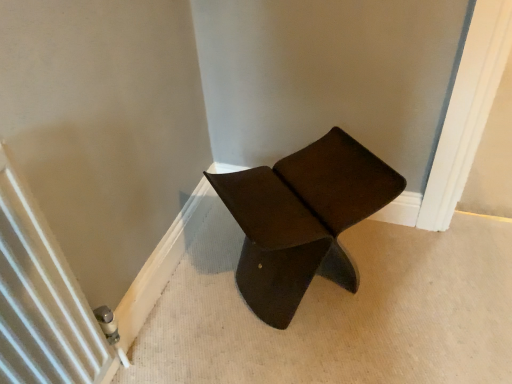
The image size is (512, 384). I want to click on brown leather stool at center, so click(302, 219).

Image resolution: width=512 pixels, height=384 pixels. Describe the element at coordinates (302, 219) in the screenshot. I see `brown leather stool at center` at that location.

The image size is (512, 384). Identify the location of brown leather stool at center. (302, 219).